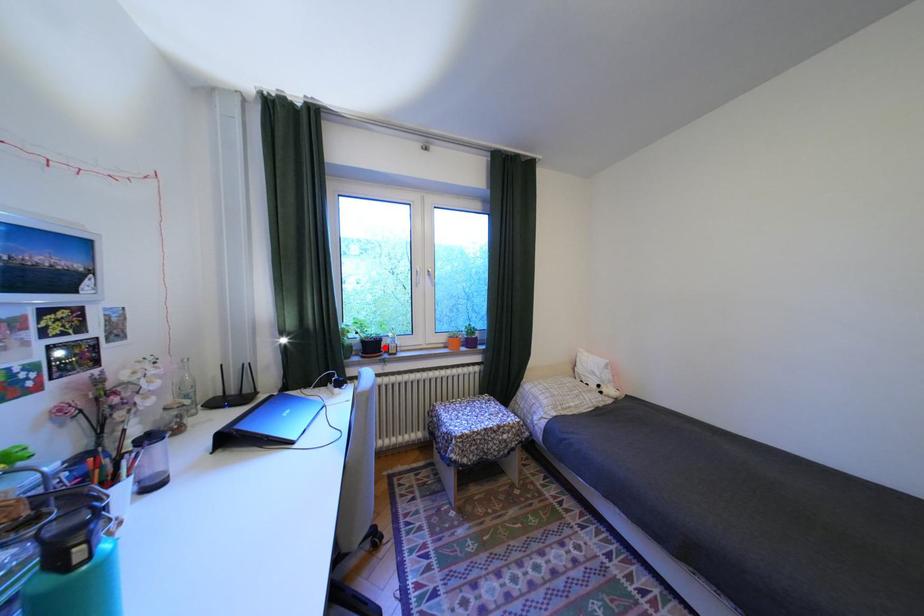
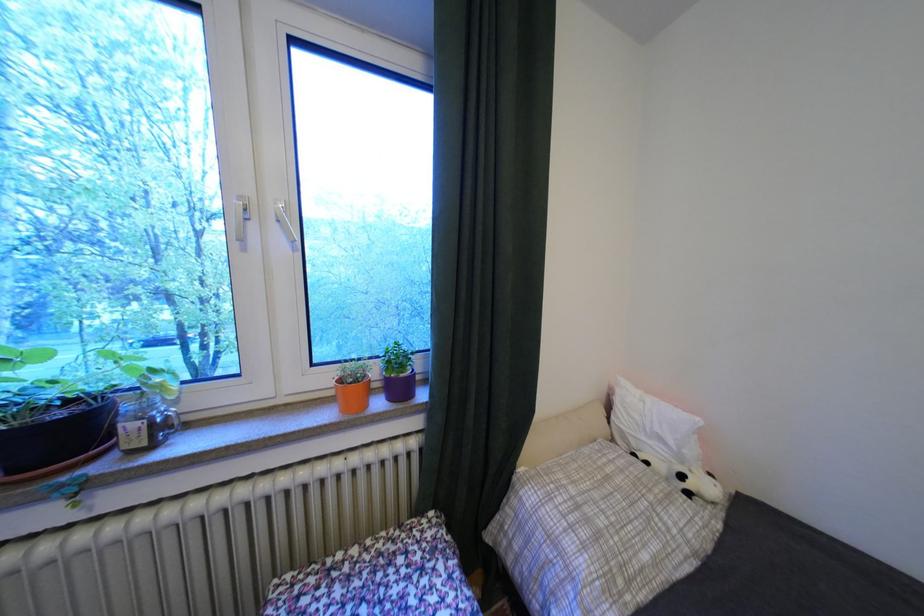
Question: I am providing you with two images of the same scene from different viewpoints. Given a red point in image1, look at the same physical point in image2. Is it:

Choices:
 (A) Closer to the viewpoint
 (B) Farther from the viewpoint

Answer: (A)